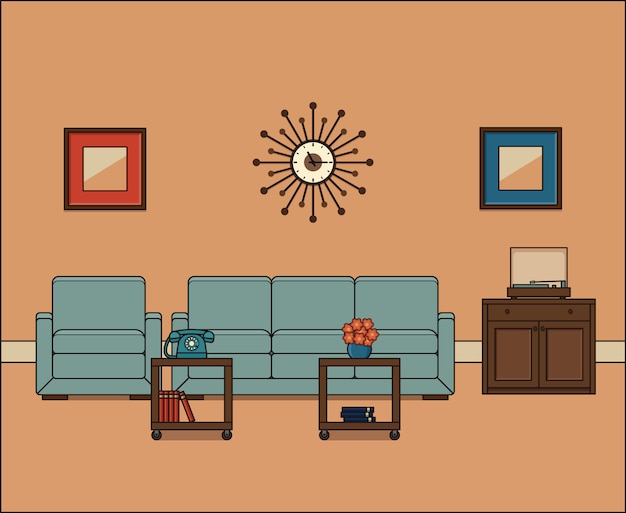
Identify the location of light blue couch. (312, 335).